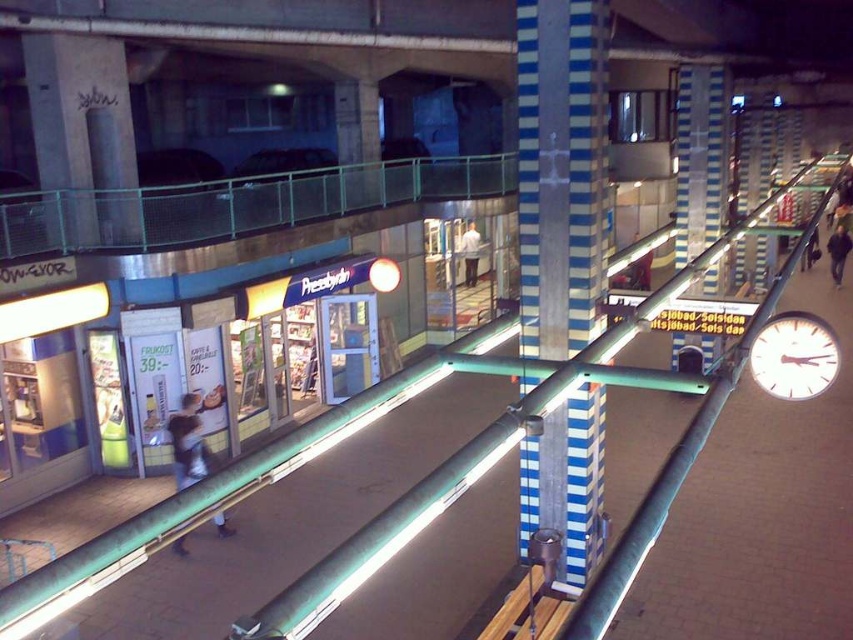
You are standing at the point marked by the coordinates point (561,172) in the image. What object are you standing on?

The point (561,172) marks the blue striped pillar at center, so you are standing on the blue striped pillar at center.